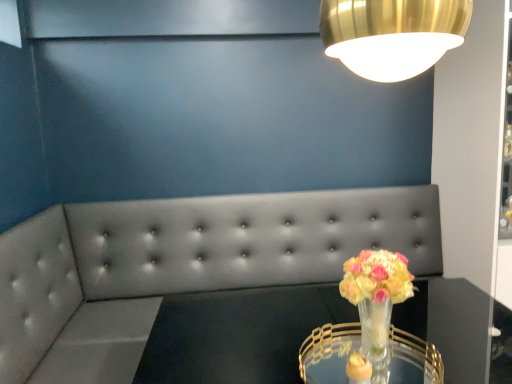
Locate an element on the screen. Image resolution: width=512 pixels, height=384 pixels. free space above clear glass table at center (from a real-world perspective) is located at coordinates (315, 323).